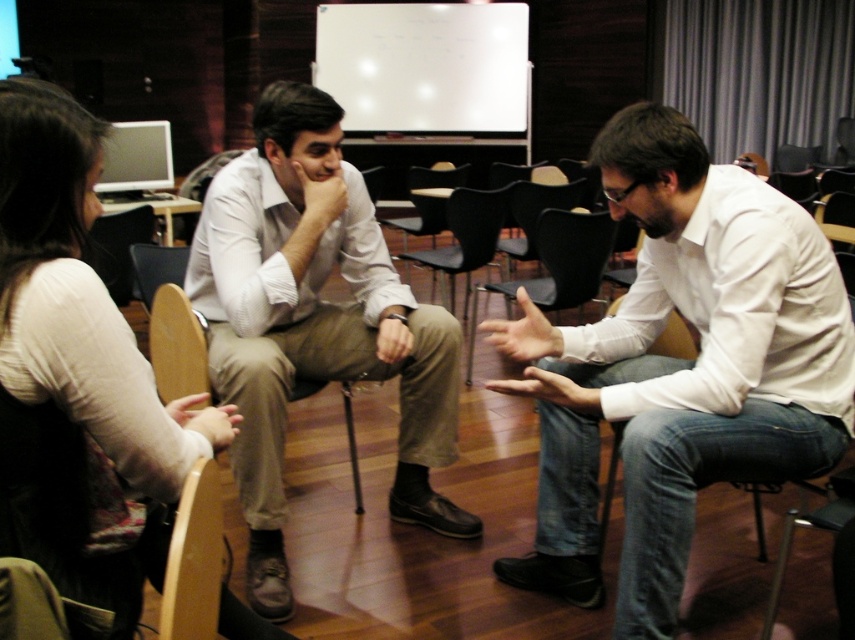
Question: Which point is closer to the camera?

Choices:
 (A) matte white shirt at upper left
 (B) white matte hand at lower left
 (C) white matte shirt at center
 (D) smooth skin hand at center

Answer: (A)

Question: From the image, what is the correct spatial relationship of matte white shirt at upper left in relation to smooth skin hand at center?

Choices:
 (A) below
 (B) above

Answer: (A)

Question: Which of the following is the closest to the observer?

Choices:
 (A) (361, 371)
 (B) (332, 216)
 (C) (273, 634)

Answer: (C)

Question: Where is matte white shirt at upper left located in relation to matte khaki pants at center in the image?

Choices:
 (A) left
 (B) right

Answer: (A)

Question: Which object is positioned farthest from the matte khaki pants at center?

Choices:
 (A) matte white shirt at upper left
 (B) white matte hand at lower left
 (C) smooth skin hand at center

Answer: (A)

Question: From the image, what is the correct spatial relationship of matte white shirt at upper left in relation to matte skin hand at center?

Choices:
 (A) above
 (B) below

Answer: (B)